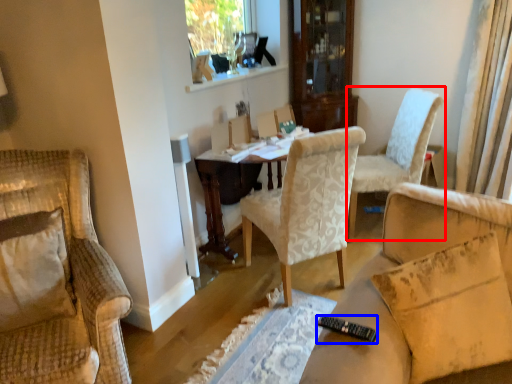
Question: Among these objects, which one is farthest to the camera, chair (highlighted by a red box) or remote control (highlighted by a blue box)?

Choices:
 (A) chair
 (B) remote control

Answer: (A)